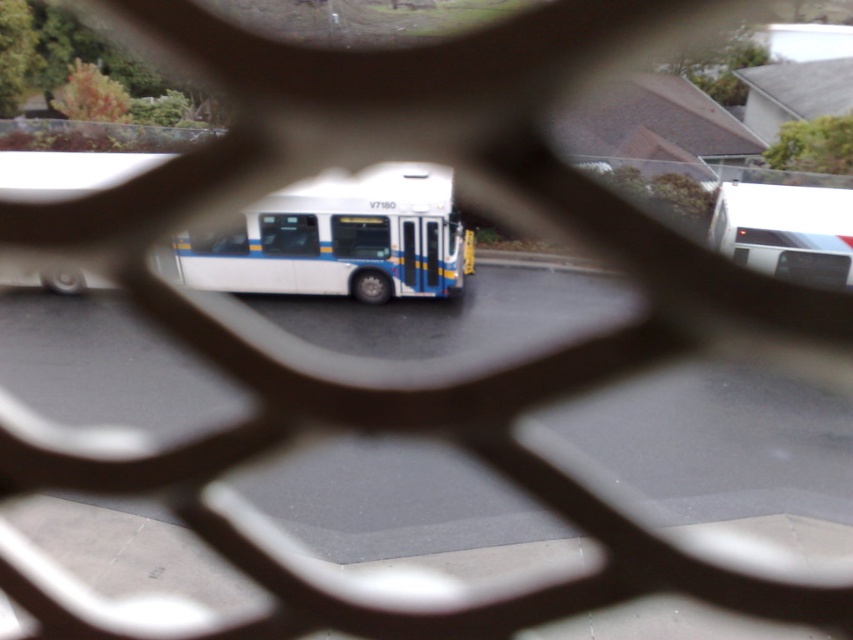
Question: Can you confirm if white matte bus at center is positioned to the right of white glossy bus at center?

Choices:
 (A) no
 (B) yes

Answer: (A)

Question: Is white matte bus at center above white glossy bus at center?

Choices:
 (A) no
 (B) yes

Answer: (A)

Question: Among these points, which one is nearest to the camera?

Choices:
 (A) (727, 225)
 (B) (329, 243)

Answer: (A)

Question: Where is white matte bus at center located in relation to white glossy bus at center in the image?

Choices:
 (A) above
 (B) below

Answer: (B)